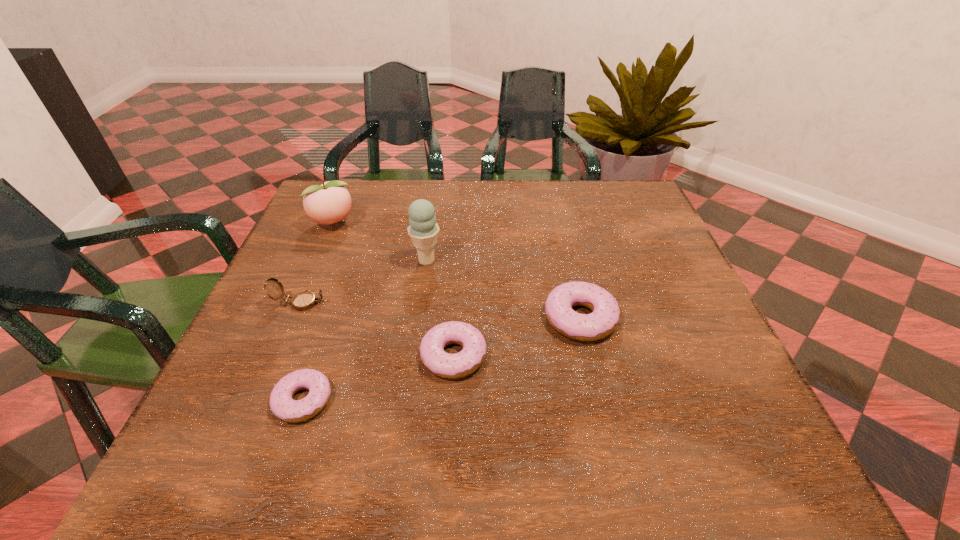
In the current image, all doughnuts are evenly spaced. To maintain this equal spacing, where should an additional doughnut be placed on the right? Please point out a free spot. Please provide its 2D coordinates. Your answer should be formatted as a tuple, i.e. [(x, y)], where the tuple contains the x and y coordinates of a point satisfying the conditions above.

[(688, 286)]